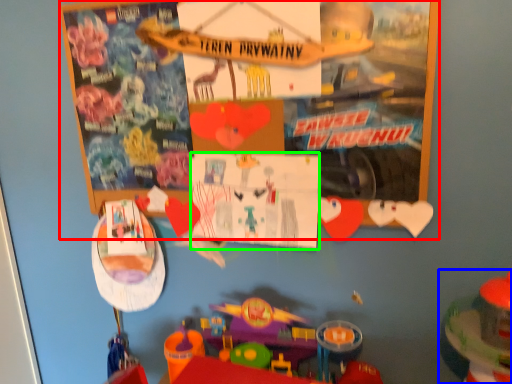
Question: Estimate the real-world distances between objects in this image. Which object is farther from bulletin board (highlighted by a red box), toy (highlighted by a blue box) or poster page (highlighted by a green box)?

Choices:
 (A) toy
 (B) poster page

Answer: (A)